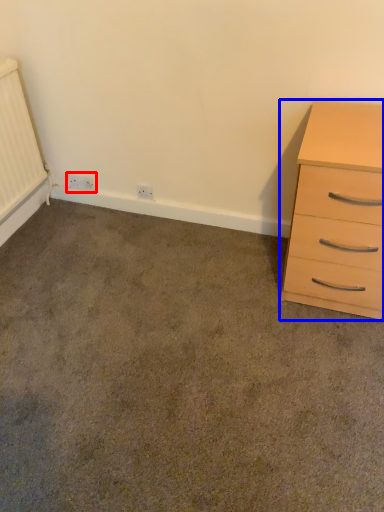
Question: Among these objects, which one is farthest to the camera, electric outlet (highlighted by a red box) or chest of drawers (highlighted by a blue box)?

Choices:
 (A) electric outlet
 (B) chest of drawers

Answer: (A)